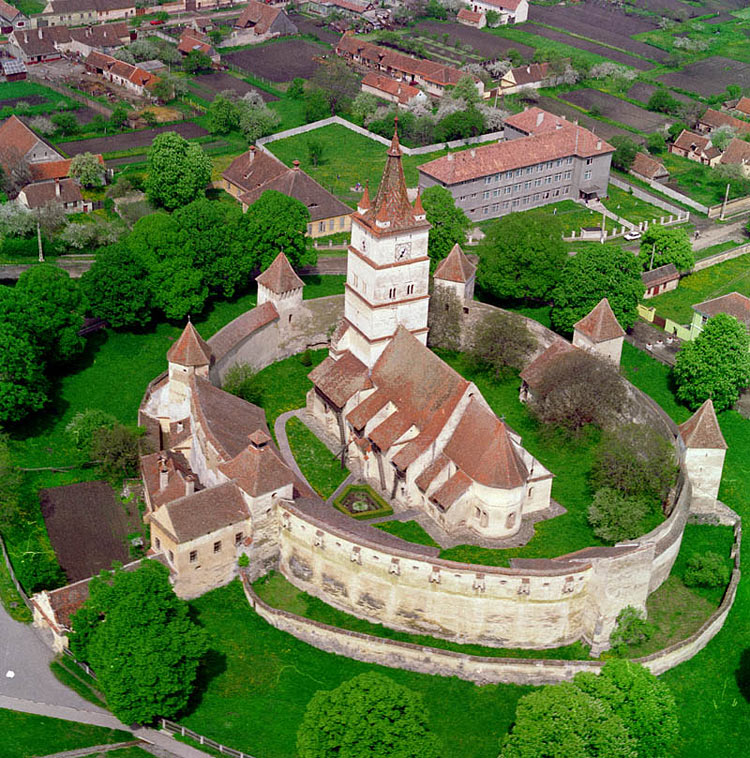
Identify the location of wall. (378, 583).